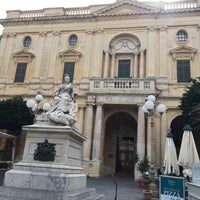
Where is `brass art`? This screenshot has height=200, width=200. brass art is located at coordinates (44, 151).